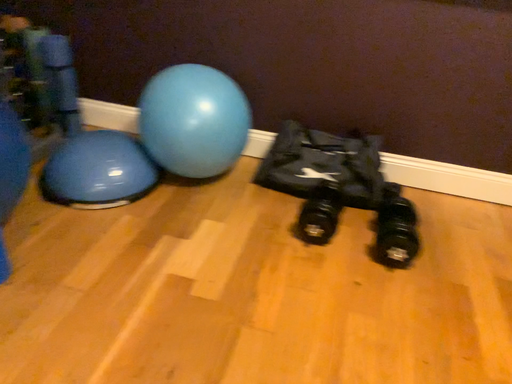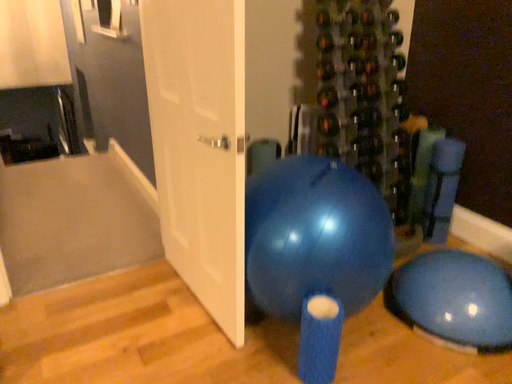
Question: How did the camera likely rotate when shooting the video?

Choices:
 (A) rotated left
 (B) rotated right

Answer: (A)